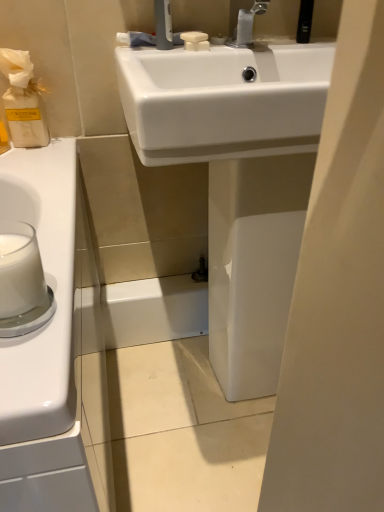
Question: Does silver metallic faucet at upper center have a lesser width compared to white glossy sink at center?

Choices:
 (A) no
 (B) yes

Answer: (B)

Question: Is silver metallic faucet at upper center at the left side of white glossy sink at center?

Choices:
 (A) no
 (B) yes

Answer: (B)

Question: From the image's perspective, does silver metallic faucet at upper center appear lower than white glossy sink at center?

Choices:
 (A) yes
 (B) no

Answer: (B)

Question: From the image's perspective, is silver metallic faucet at upper center located above white glossy sink at center?

Choices:
 (A) no
 (B) yes

Answer: (B)

Question: Does silver metallic faucet at upper center lie behind white glossy sink at center?

Choices:
 (A) yes
 (B) no

Answer: (A)

Question: Looking at the image, does white glossy sink at center seem bigger or smaller compared to white matte soap at upper center?

Choices:
 (A) small
 (B) big

Answer: (B)

Question: From the image's perspective, relative to white matte soap at upper center, is white glossy sink at center above or below?

Choices:
 (A) below
 (B) above

Answer: (A)

Question: Considering the positions of white glossy sink at center and white matte soap at upper center in the image, is white glossy sink at center wider or thinner than white matte soap at upper center?

Choices:
 (A) thin
 (B) wide

Answer: (B)

Question: In the image, is white glossy sink at center on the left side or the right side of white matte soap at upper center?

Choices:
 (A) left
 (B) right

Answer: (B)

Question: Considering their positions, is silver metallic faucet at upper center located in front of or behind white opaque glass at left?

Choices:
 (A) behind
 (B) front

Answer: (A)

Question: From a real-world perspective, is silver metallic faucet at upper center physically located above or below white opaque glass at left?

Choices:
 (A) above
 (B) below

Answer: (A)

Question: Is silver metallic faucet at upper center situated inside white opaque glass at left or outside?

Choices:
 (A) outside
 (B) inside

Answer: (A)

Question: From the image's perspective, relative to white opaque glass at left, is silver metallic faucet at upper center above or below?

Choices:
 (A) above
 (B) below

Answer: (A)

Question: Considering the positions of white opaque glass at left and white glossy sink at center in the image, is white opaque glass at left taller or shorter than white glossy sink at center?

Choices:
 (A) tall
 (B) short

Answer: (B)

Question: Based on their sizes in the image, would you say white opaque glass at left is bigger or smaller than white glossy sink at center?

Choices:
 (A) small
 (B) big

Answer: (A)